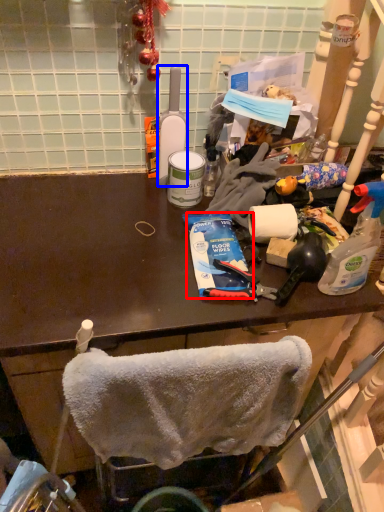
Question: Among these objects, which one is farthest to the camera, toothpaste (highlighted by a red box) or bottle (highlighted by a blue box)?

Choices:
 (A) toothpaste
 (B) bottle

Answer: (B)